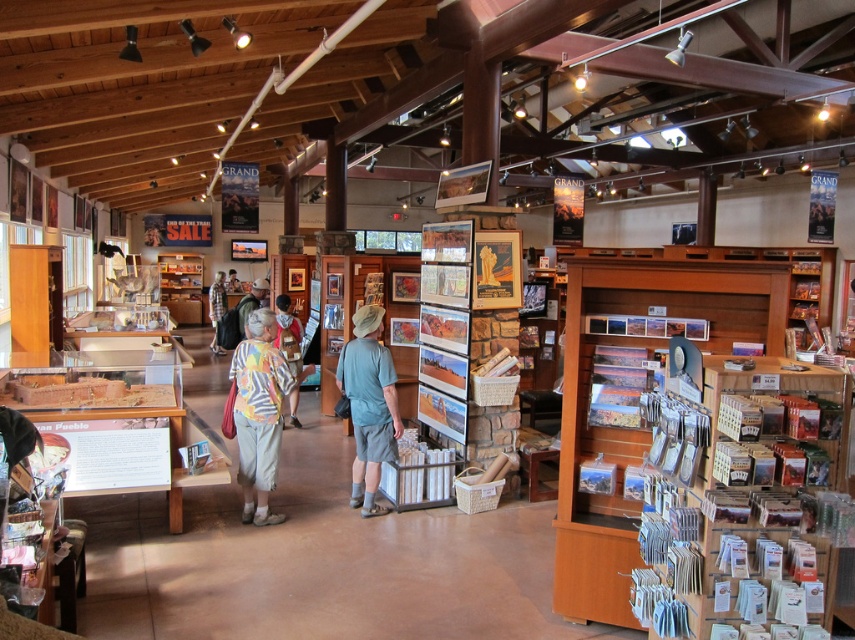
Question: Which object appears farthest from the camera in this image?

Choices:
 (A) light blue fabric shirt at center
 (B) camouflage jacket at center
 (C) striped shirt at center

Answer: (B)

Question: Among these points, which one is farthest from the camera?

Choices:
 (A) (287, 310)
 (B) (221, 282)
 (C) (248, 401)
 (D) (266, 285)

Answer: (B)

Question: Is light blue fabric shirt at center thinner than striped shirt at center?

Choices:
 (A) no
 (B) yes

Answer: (A)

Question: Does light blue fabric shirt at center have a greater width compared to camouflage jacket at center?

Choices:
 (A) yes
 (B) no

Answer: (A)

Question: Can you confirm if plaid shirt at center is positioned above camouflage jacket at center?

Choices:
 (A) yes
 (B) no

Answer: (A)

Question: Among these objects, which one is farthest from the camera?

Choices:
 (A) plaid shirt at center
 (B) light blue fabric shirt at center
 (C) camouflage jacket at center
 (D) striped shirt at center

Answer: (A)